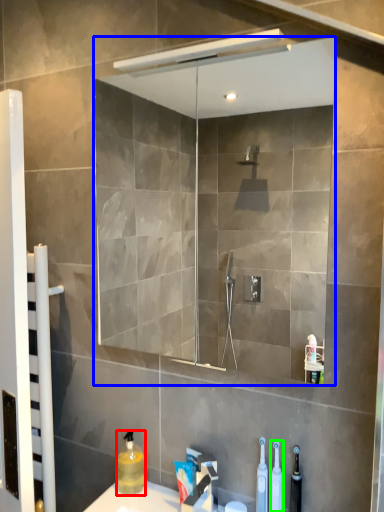
Question: Which object is positioned closest to cleaning product (highlighted by a red box)? Select from mirror (highlighted by a blue box) and cleaning product (highlighted by a green box).

Choices:
 (A) mirror
 (B) cleaning product

Answer: (B)